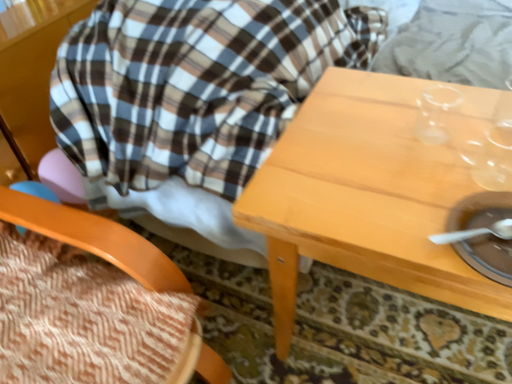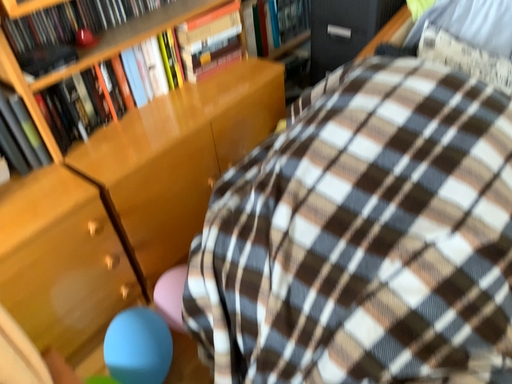
Question: Which way did the camera rotate in the video?

Choices:
 (A) rotated right
 (B) rotated left

Answer: (B)